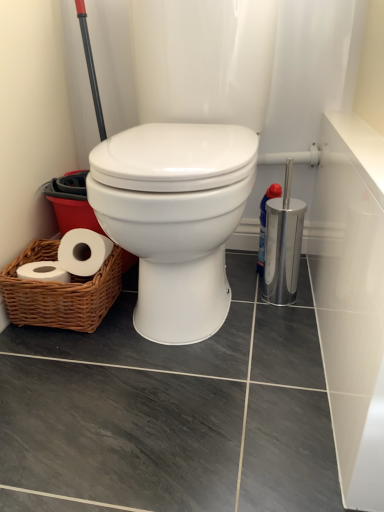
Where is `free space in front of woven brown basket at lower left`? free space in front of woven brown basket at lower left is located at coordinates (69, 334).